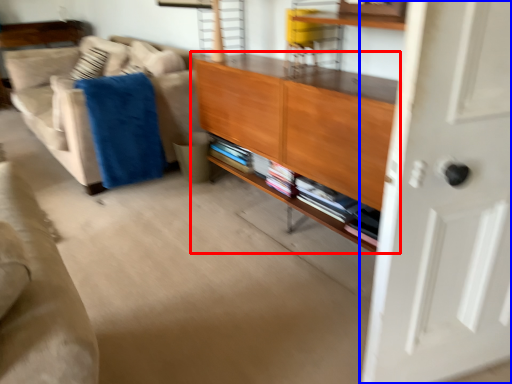
Question: Which object is further to the camera taking this photo, cabinetry (highlighted by a red box) or door (highlighted by a blue box)?

Choices:
 (A) cabinetry
 (B) door

Answer: (A)